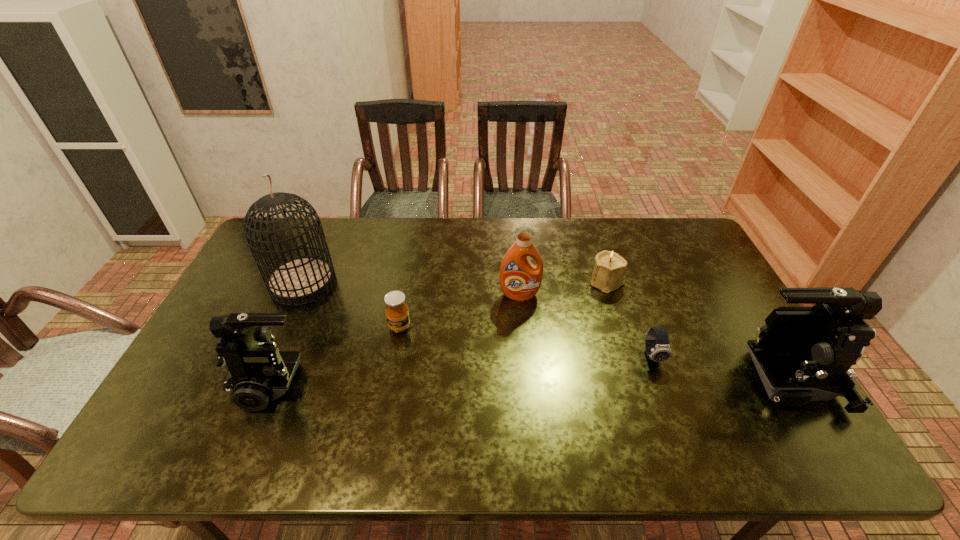
Identify the location of the left camcorder. The height and width of the screenshot is (540, 960). (258, 372).

The height and width of the screenshot is (540, 960). Identify the location of the taller camcorder. (802, 354).

Locate an element on the screen. The height and width of the screenshot is (540, 960). the rightmost object is located at coordinates (802, 354).

Locate an element on the screen. This screenshot has width=960, height=540. candle_holder is located at coordinates (608, 275).

This screenshot has width=960, height=540. Find the location of `the second shortest object`. the second shortest object is located at coordinates (397, 313).

Where is `honey`? This screenshot has height=540, width=960. honey is located at coordinates (397, 313).

I want to click on birdcage, so tap(298, 281).

This screenshot has width=960, height=540. Find the location of `watch`. watch is located at coordinates (657, 346).

The height and width of the screenshot is (540, 960). What are the coordinates of `detergent` in the screenshot? It's located at tap(520, 280).

You are a GUI agent. You are given a task and a screenshot of the screen. Output one action in this format:
    pyautogui.click(x=<x>, y=<y>)
    Task: Click on the vacant area situated on the lens mount of the left camcorder
    
    Given the screenshot: What is the action you would take?
    pos(199,381)